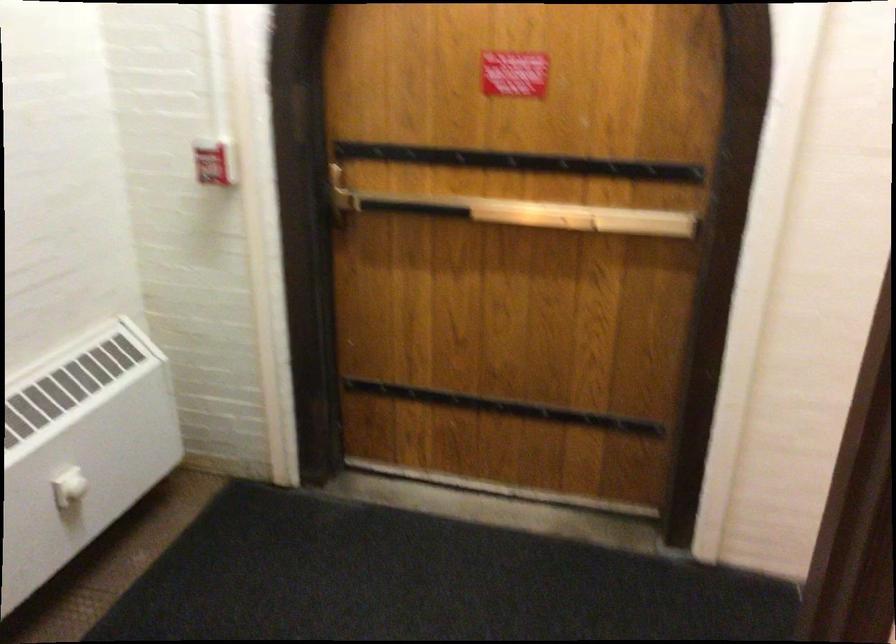
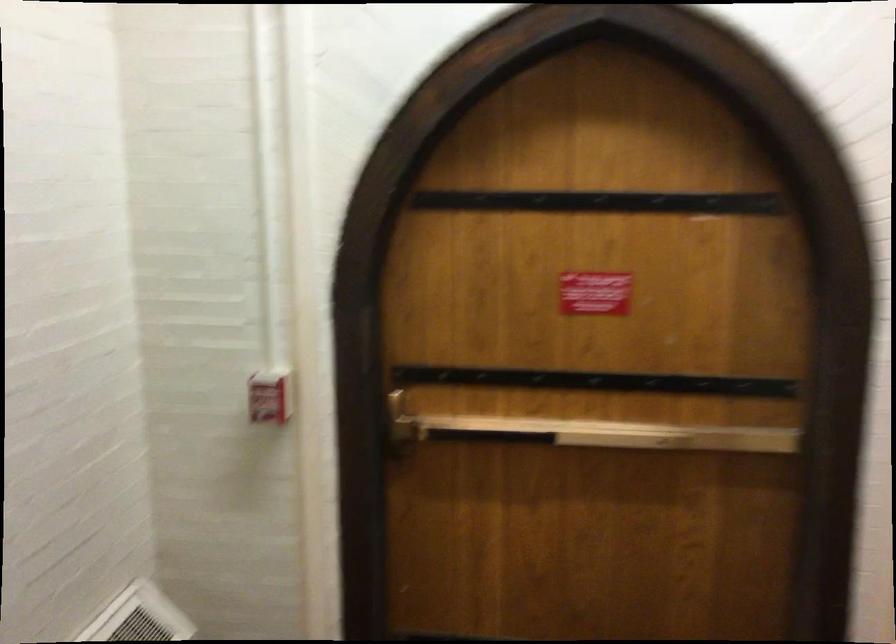
The point at (211, 162) is marked in the first image. Where is the corresponding point in the second image?

(270, 395)